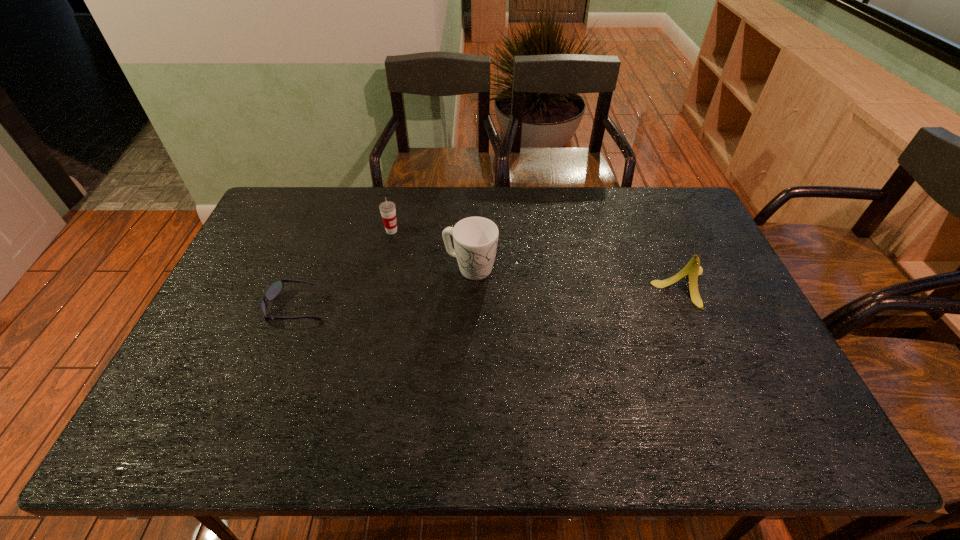
Image resolution: width=960 pixels, height=540 pixels. I want to click on object that ranks as the third closest to the leftmost object, so click(x=693, y=269).

Find the location of `the closest object to the cup`. the closest object to the cup is located at coordinates (475, 239).

I want to click on vacant position in the image that satisfies the following two spatial constraints: 1. on the front side of the rightmost object; 2. on the right side of the third object from left to right, so (x=469, y=287).